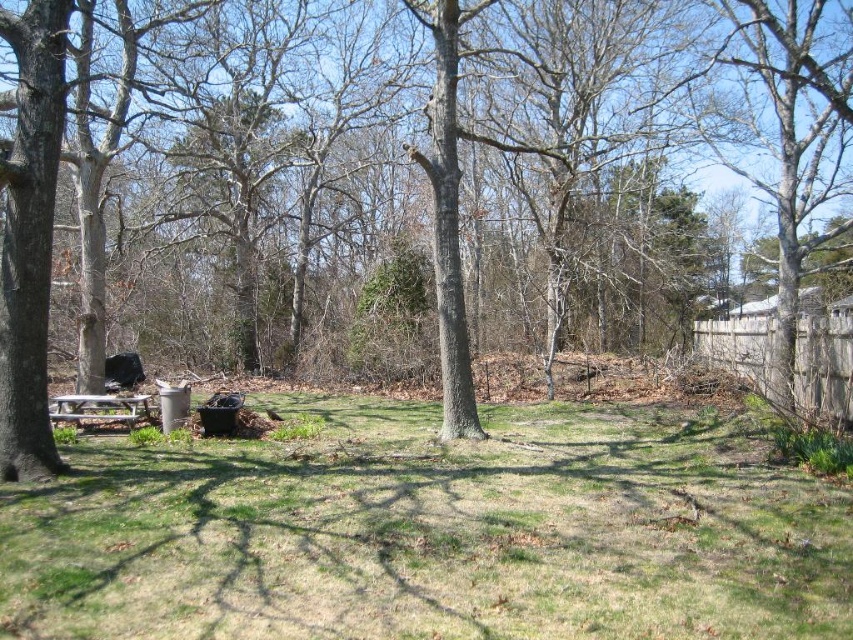
Is bare wood tree at right to the left of wooden picnic table at lower left from the viewer's perspective?

In fact, bare wood tree at right is to the right of wooden picnic table at lower left.

Can you confirm if bare wood tree at right is thinner than wooden picnic table at lower left?

In fact, bare wood tree at right might be wider than wooden picnic table at lower left.

You are a GUI agent. You are given a task and a screenshot of the screen. Output one action in this format:
    pyautogui.click(x=<x>, y=<y>)
    Task: Click on the bare wood tree at right
    Image resolution: width=853 pixels, height=640 pixels.
    Given the screenshot: What is the action you would take?
    pyautogui.click(x=788, y=148)

Which is in front, point (393, 609) or point (842, 380)?

Point (393, 609)

Does green grassy at center have a greater width compared to wooden fence at right?

Correct, the width of green grassy at center exceeds that of wooden fence at right.

Who is more distant from viewer, [308,477] or [844,349]?

The point [844,349] is more distant.

Find the location of a particular element. This screenshot has width=853, height=640. green grassy at center is located at coordinates (431, 532).

Is the position of wooden fence at right more distant than that of wooden picnic table at lower left?

No, wooden fence at right is in front of wooden picnic table at lower left.

Who is higher up, wooden fence at right or wooden picnic table at lower left?

wooden fence at right is higher up.

At what (x,y) coordinates should I click in order to perform the action: click on wooden fence at right. Please return your answer as a coordinate pair (x, y). This screenshot has width=853, height=640. Looking at the image, I should click on (824, 360).